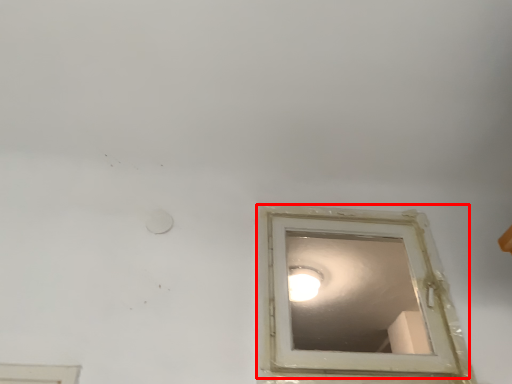
Question: Where is window (annotated by the red box) located in relation to lighting in the image?

Choices:
 (A) right
 (B) left

Answer: (A)